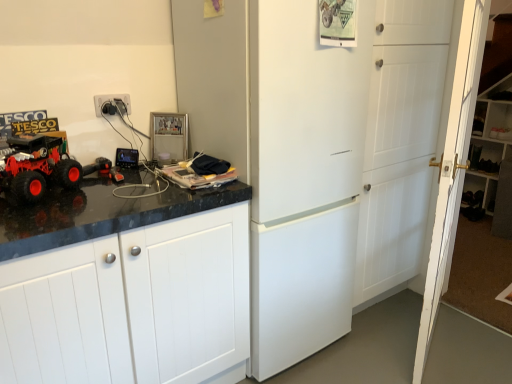
Question: Is white matte cabinet at left facing towards rubberized red truck at left?

Choices:
 (A) yes
 (B) no

Answer: (B)

Question: From a real-world perspective, does white matte cabinet at left stand above rubberized red truck at left?

Choices:
 (A) no
 (B) yes

Answer: (A)

Question: Can you confirm if white matte cabinet at left is positioned to the right of rubberized red truck at left?

Choices:
 (A) no
 (B) yes

Answer: (B)

Question: Does white matte cabinet at left touch rubberized red truck at left?

Choices:
 (A) no
 (B) yes

Answer: (A)

Question: Can you confirm if white matte cabinet at left is positioned to the left of rubberized red truck at left?

Choices:
 (A) no
 (B) yes

Answer: (A)

Question: Does white matte cabinet at left have a greater height compared to rubberized red truck at left?

Choices:
 (A) yes
 (B) no

Answer: (A)

Question: Does white plastic electric outlet at upper left appear on the right side of metallic silver frame at upper center?

Choices:
 (A) yes
 (B) no

Answer: (B)

Question: Is white plastic electric outlet at upper left positioned in front of metallic silver frame at upper center?

Choices:
 (A) yes
 (B) no

Answer: (A)

Question: From the image's perspective, is white plastic electric outlet at upper left located beneath metallic silver frame at upper center?

Choices:
 (A) no
 (B) yes

Answer: (A)

Question: Is white plastic electric outlet at upper left taller than metallic silver frame at upper center?

Choices:
 (A) no
 (B) yes

Answer: (A)

Question: Is white plastic electric outlet at upper left shorter than metallic silver frame at upper center?

Choices:
 (A) yes
 (B) no

Answer: (A)

Question: Does white plastic electric outlet at upper left have a greater width compared to metallic silver frame at upper center?

Choices:
 (A) yes
 (B) no

Answer: (B)

Question: Is white plastic electric outlet at upper left with white matte refrigerator at center?

Choices:
 (A) yes
 (B) no

Answer: (B)